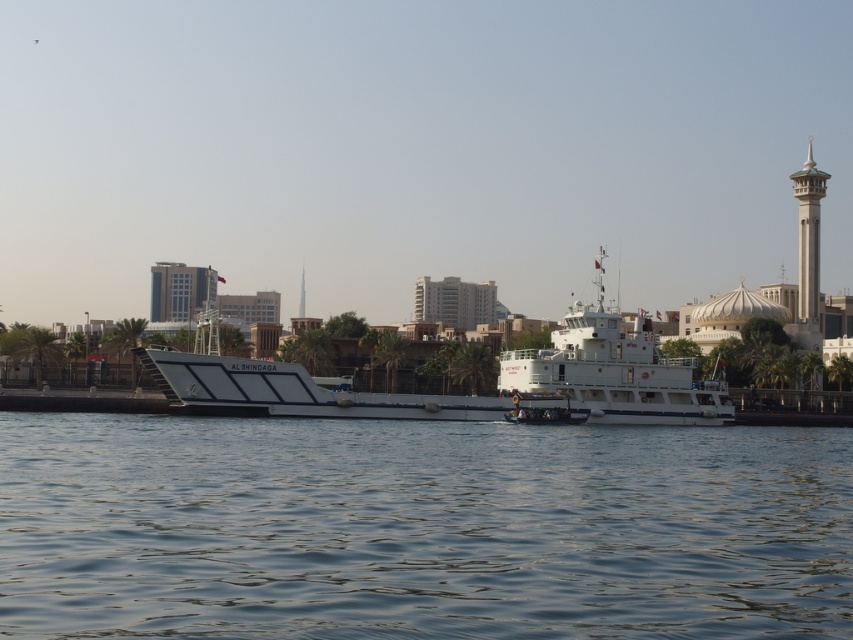
Question: Which object is positioned closest to the clear water at center?

Choices:
 (A) white stone minaret at upper right
 (B) white matte ferry at center
 (C) white matte boat at center

Answer: (C)

Question: Can you confirm if white matte ferry at center is wider than white stone minaret at upper right?

Choices:
 (A) yes
 (B) no

Answer: (A)

Question: Which point is farther to the camera?

Choices:
 (A) white stone minaret at upper right
 (B) white matte boat at center

Answer: (A)

Question: Which point appears closest to the camera in this image?

Choices:
 (A) (809, 308)
 (B) (396, 394)
 (C) (509, 380)
 (D) (676, 484)

Answer: (D)

Question: Is white matte boat at center bigger than white stone minaret at upper right?

Choices:
 (A) no
 (B) yes

Answer: (A)

Question: Can you confirm if white matte boat at center is bigger than white stone minaret at upper right?

Choices:
 (A) no
 (B) yes

Answer: (A)